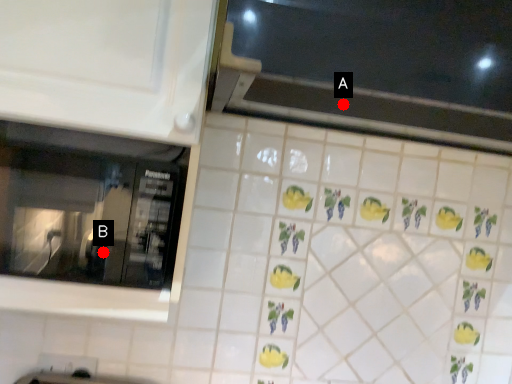
Question: Two points are circled on the image, labeled by A and B beside each circle. Which of the following is the farthest from the observer?

Choices:
 (A) A is further
 (B) B is further

Answer: (A)